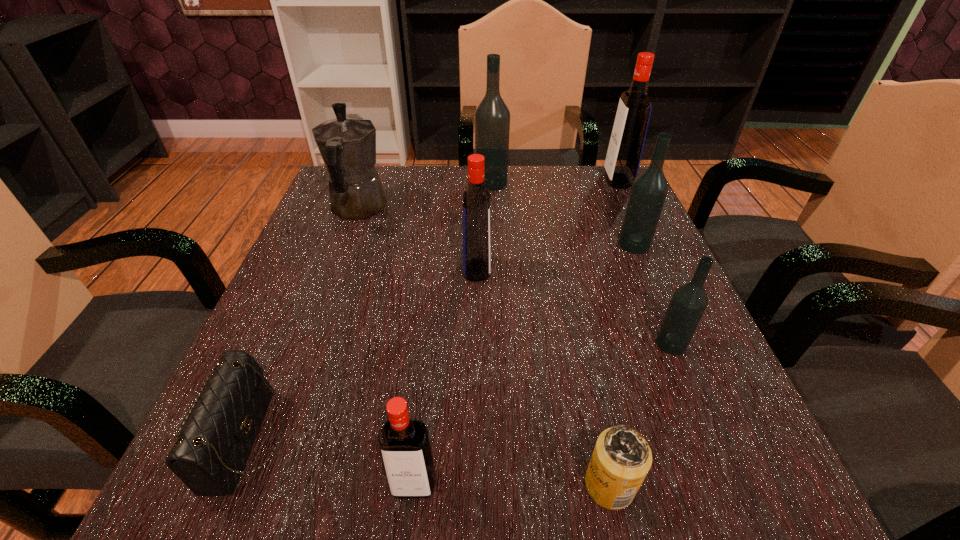
This screenshot has width=960, height=540. I want to click on vacant area that lies between the second farthest red vodka and the sixth farthest object, so click(574, 307).

Identify the location of the fifth closest object relative to the second biggest red vodka. This screenshot has height=540, width=960. (209, 455).

Identify the location of object that is the closest one to the sixth farthest object. (621, 459).

Where is `vodka that is the closest to the farthest red vodka`? This screenshot has width=960, height=540. vodka that is the closest to the farthest red vodka is located at coordinates (649, 190).

Select which vodka appears as the closest to the nearest vodka. Please provide its 2D coordinates. Your answer should be formatted as a tuple, i.e. [(x, y)], where the tuple contains the x and y coordinates of a point satisfying the conditions above.

[(476, 202)]

Identify which red vodka is the third closest to the fifth farthest vodka. Please provide its 2D coordinates. Your answer should be formatted as a tuple, i.e. [(x, y)], where the tuple contains the x and y coordinates of a point satisfying the conditions above.

[(626, 144)]

Identify the location of red vodka that is the second closest to the coffeepot. (404, 444).

Locate an element on the screen. The image size is (960, 540). black vodka that stands as the third closest to the beer can is located at coordinates (492, 117).

Select which black vodka appears as the closest to the second biggest black vodka. Please provide its 2D coordinates. Your answer should be formatted as a tuple, i.e. [(x, y)], where the tuple contains the x and y coordinates of a point satisfying the conditions above.

[(688, 303)]

At what (x,y) coordinates should I click in order to perform the action: click on vacant space that satisfies the following two spatial constraints: 1. on the front and back of the fourth object from right to left; 2. on the left side of the leftmost red vodka. Please return your answer as a coordinate pair (x, y). The image size is (960, 540). Looking at the image, I should click on (414, 485).